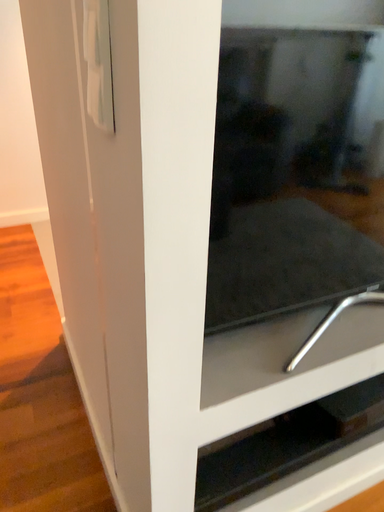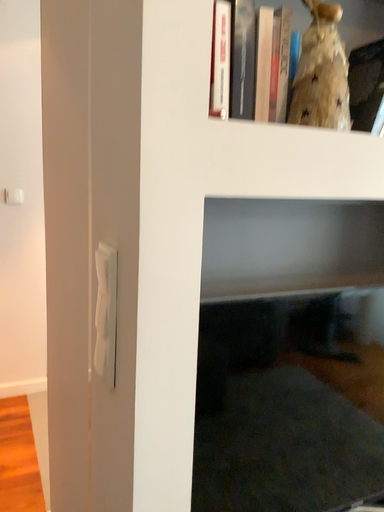
Question: How did the camera likely rotate when shooting the video?

Choices:
 (A) rotated downward
 (B) rotated upward

Answer: (B)